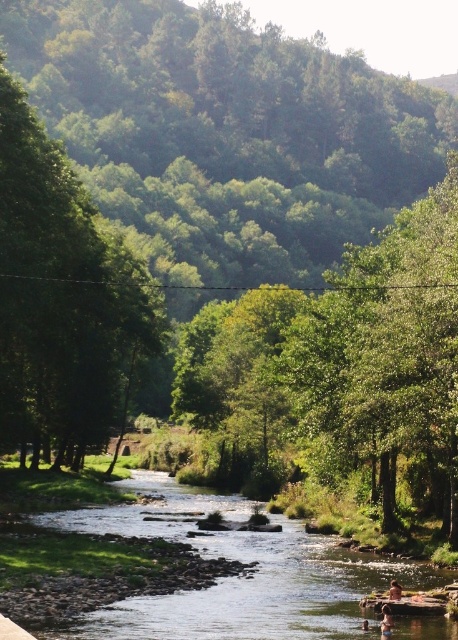
You are planning to cross the river using a small wooden bridge that can only support objects larger than the clear water stream at center. Can the smooth skin person at lower right safely cross the bridge?

The clear water stream at center has a larger size compared to the smooth skin person at lower right. Since the bridge requires objects larger than the stream to cross, the smooth skin person at lower right is smaller and therefore cannot safely cross the bridge.

You are standing at the edge of the river and see both the tan skin person at river center and the smooth skin person at lower right. Which person is positioned closer to your left side?

The tan skin person at river center is positioned to the left of the smooth skin person at lower right, so the tan skin person at river center is closer to your left side.

You are a photographer positioned at the riverbank. You want to capture a photo that includes both the tan skin person at river center and the smooth skin person at lower right. Given the distance between them, what is the minimum focal length lens you should use to ensure both subjects are in frame without distortion?

The tan skin person at river center and smooth skin person at lower right are 6.24 feet apart. To capture both in frame without distortion, a wide angle lens with a focal length of 35mm or lower is recommended.